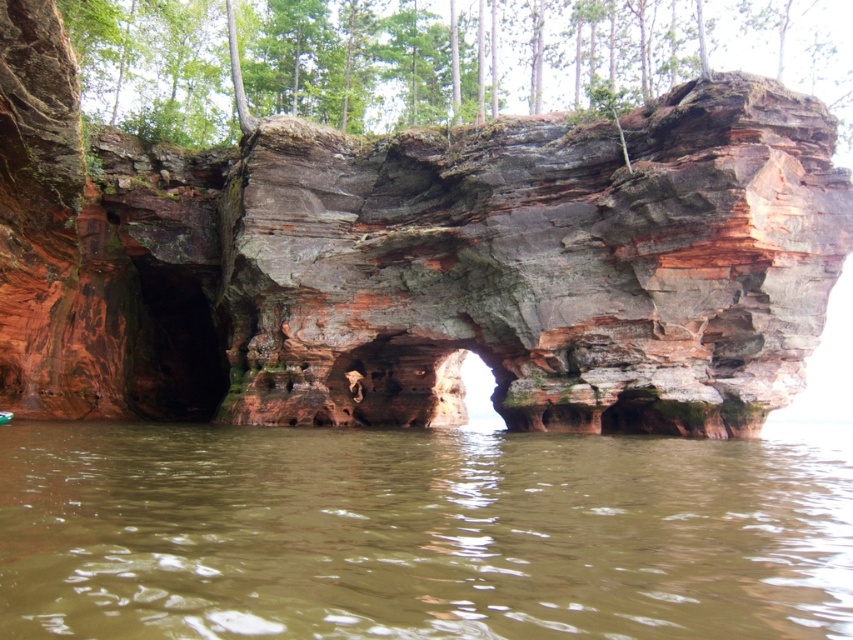
Between rustic stone arch at center and brown murky water at lower center, which one appears on the left side from the viewer's perspective?

From the viewer's perspective, rustic stone arch at center appears more on the left side.

Is point (296, 262) positioned after point (12, 426)?

Yes, point (296, 262) is behind point (12, 426).

The image size is (853, 640). What do you see at coordinates (416, 260) in the screenshot? I see `rustic stone arch at center` at bounding box center [416, 260].

Image resolution: width=853 pixels, height=640 pixels. What are the coordinates of `rustic stone arch at center` in the screenshot? It's located at (416, 260).